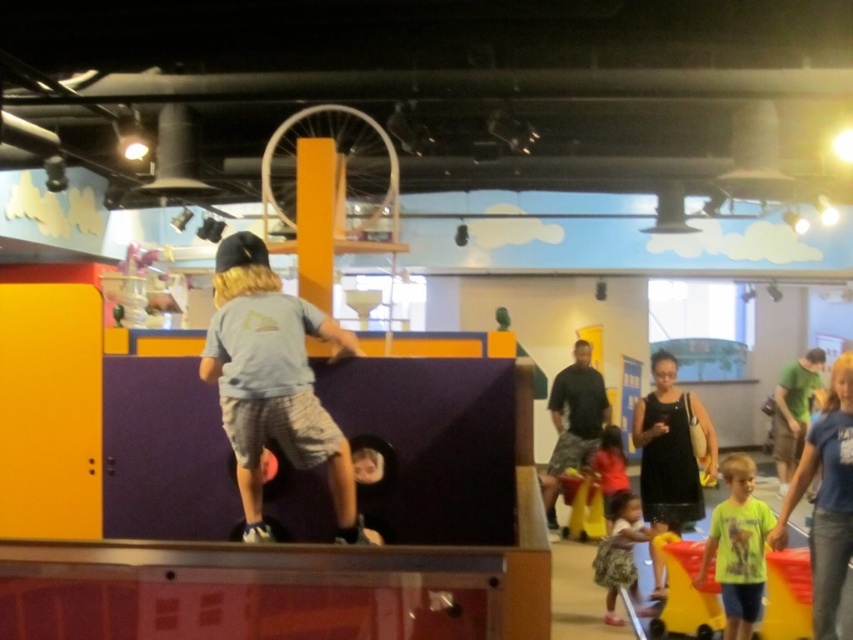
You are a photographer in the play area and want to capture both the dark gray camouflage shorts at center and the printed floral dress at lower right in a single shot. Based on their positions, can you frame the shot so that both are visible without moving either subject?

The dark gray camouflage shorts at center is above the printed floral dress at lower right, so yes, you can frame the shot to include both by ensuring the camera angle captures the vertical space between them.

In the scene shown: What is located at the coordinates point (x=671, y=449) in the image?

The point (x=671, y=449) indicates a black dress at center.

You are a photographer setting up a shoot in this play area. You want to ensure both the black dress at center and the light blue shirt at center are visible in the frame. Based on their heights, which one might you need to adjust your camera angle to capture properly?

The black dress at center is taller than the light blue shirt at center, so you might need to angle the camera upward to capture the black dress at center fully while ensuring the light blue shirt at center remains in view.